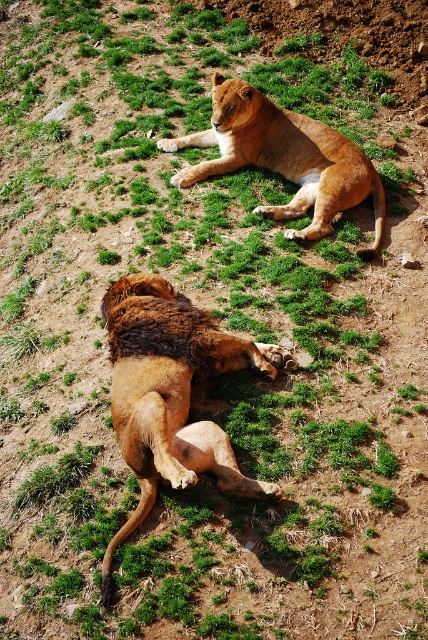
Is point (128, 330) closer to camera compared to point (264, 104)?

Yes, point (128, 330) is in front of point (264, 104).

Is point (143, 273) positioned after point (186, 134)?

No, it is not.

Locate an element on the screen. brown shaggy lion at lower left is located at coordinates (172, 394).